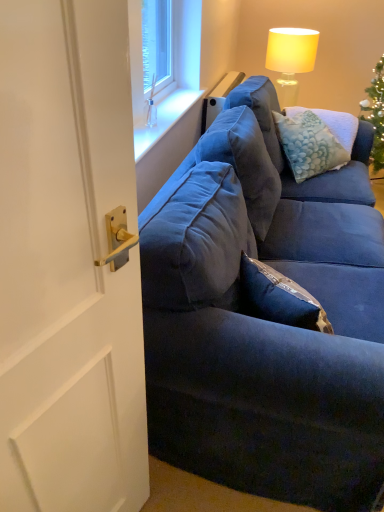
Question: Considering the relative sizes of white glossy door handle at left and velvety blue pillow at upper right in the image provided, is white glossy door handle at left smaller than velvety blue pillow at upper right?

Choices:
 (A) yes
 (B) no

Answer: (A)

Question: From the image's perspective, would you say white glossy door handle at left is shown under velvety blue pillow at upper right?

Choices:
 (A) no
 (B) yes

Answer: (B)

Question: From a real-world perspective, does white glossy door handle at left sit lower than velvety blue pillow at upper right?

Choices:
 (A) yes
 (B) no

Answer: (B)

Question: Considering the relative sizes of white glossy door handle at left and velvety blue pillow at upper right in the image provided, is white glossy door handle at left shorter than velvety blue pillow at upper right?

Choices:
 (A) no
 (B) yes

Answer: (A)

Question: Is white glossy door handle at left touching velvety blue pillow at upper right?

Choices:
 (A) no
 (B) yes

Answer: (A)

Question: From the image's perspective, relative to velvet blue couch at right, is matte yellow fabric lampshade at upper right above or below?

Choices:
 (A) above
 (B) below

Answer: (A)

Question: From a real-world perspective, is matte yellow fabric lampshade at upper right positioned above or below velvet blue couch at right?

Choices:
 (A) above
 (B) below

Answer: (A)

Question: Considering the positions of matte yellow fabric lampshade at upper right and velvet blue couch at right in the image, is matte yellow fabric lampshade at upper right wider or thinner than velvet blue couch at right?

Choices:
 (A) wide
 (B) thin

Answer: (B)

Question: Is matte yellow fabric lampshade at upper right in front of or behind velvet blue couch at right in the image?

Choices:
 (A) front
 (B) behind

Answer: (B)

Question: Is velvety blue pillow at upper right inside the boundaries of white glossy door handle at left, or outside?

Choices:
 (A) inside
 (B) outside

Answer: (B)

Question: Considering the positions of velvety blue pillow at upper right and white glossy door handle at left in the image, is velvety blue pillow at upper right taller or shorter than white glossy door handle at left?

Choices:
 (A) tall
 (B) short

Answer: (B)

Question: Considering their positions, is velvety blue pillow at upper right located in front of or behind white glossy door handle at left?

Choices:
 (A) front
 (B) behind

Answer: (B)

Question: Visually, is velvety blue pillow at upper right positioned to the left or to the right of white glossy door handle at left?

Choices:
 (A) left
 (B) right

Answer: (B)

Question: Is white glossy door handle at left wider or thinner than matte yellow fabric lampshade at upper right?

Choices:
 (A) wide
 (B) thin

Answer: (B)

Question: Based on their positions, is white glossy door handle at left located to the left or right of matte yellow fabric lampshade at upper right?

Choices:
 (A) left
 (B) right

Answer: (A)